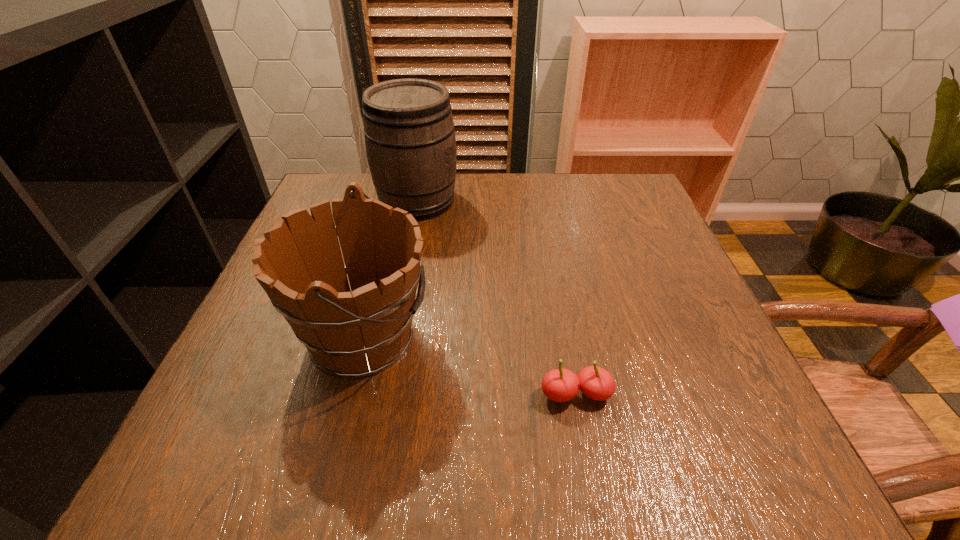
Locate an element on the screen. This screenshot has height=540, width=960. vacant space at the left edge is located at coordinates (261, 298).

This screenshot has width=960, height=540. In the image, there is a desktop. Find the location of `vacant area at the right edge`. vacant area at the right edge is located at coordinates (628, 281).

Identify the location of blank space at the far left corner of the desktop. This screenshot has height=540, width=960. (341, 174).

Where is `free space at the far right corner of the desktop`? The image size is (960, 540). free space at the far right corner of the desktop is located at coordinates (584, 195).

I want to click on free area in between the farthest object and the cherry, so click(x=496, y=297).

The image size is (960, 540). Identify the location of free space between the farther wine bucket and the cherry. (496, 297).

Where is `free area in between the nearer wine bucket and the cherry`? free area in between the nearer wine bucket and the cherry is located at coordinates (469, 366).

Image resolution: width=960 pixels, height=540 pixels. In order to click on empty location between the nearer wine bucket and the shortest object in this screenshot , I will do `click(469, 366)`.

The image size is (960, 540). Find the location of `vacant space that is in between the nearer wine bucket and the rightmost object`. vacant space that is in between the nearer wine bucket and the rightmost object is located at coordinates (469, 366).

What are the coordinates of `empty space between the nearer wine bucket and the shortest object` in the screenshot? It's located at (469, 366).